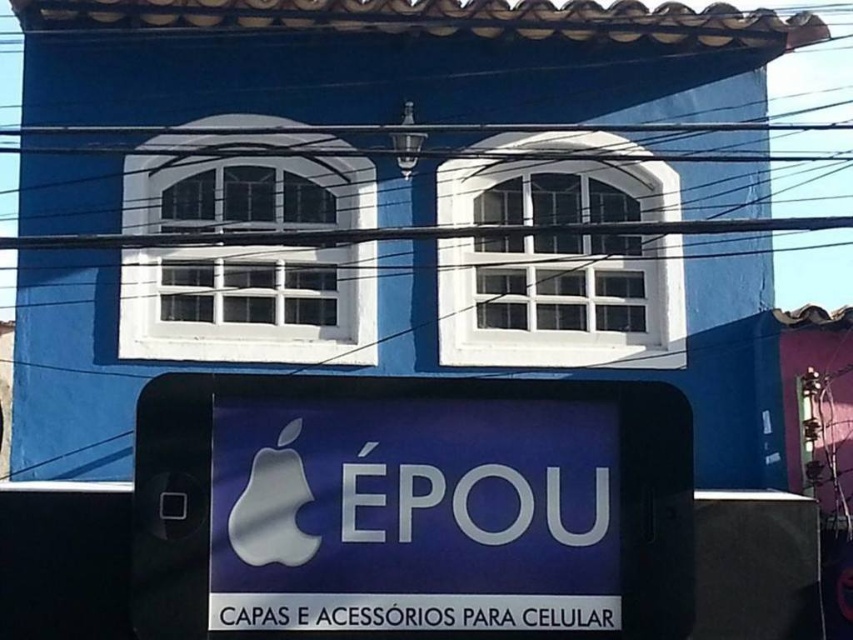
You are a delivery person who needs to place a white plastic phone at center and a satin silver apple at center on a shelf. The shelf has limited space. Which object should you place first to ensure both fit properly?

The white plastic phone at center should be placed first since it is positioned under the satin silver apple at center, indicating it occupies a lower position and likely requires less vertical space.

You are designing a poster for a tech event and need to place both the white plastic phone at center and the satin silver apple at center on the poster. Which object should you make larger to maintain the same proportions as shown in the image?

The white plastic phone at center should be made larger because it is much taller than the satin silver apple at center in the image.